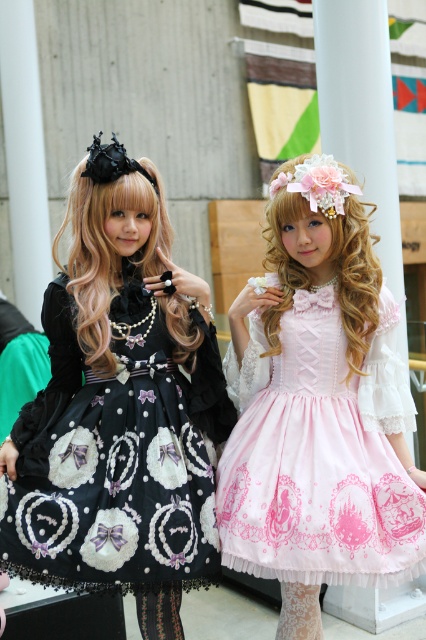
You are standing in front of the two people in the image. You want to place a small bouquet of flowers exactly at point (319, 454). Which person is the bouquet closer to?

The point (319, 454) is where the pink satin dress at center is located, so the bouquet would be closer to the person wearing the pink satin dress at center.

You are standing in front of the two individuals in the image. If you want to hand an accessory to the person wearing the black lace dress at left, which direction should you move towards based on their position?

The black lace dress at left is located at point (117,458), so you should move towards the left side of the image to reach the person wearing the black lace dress at left.

You are a photographer setting up for a photoshoot. You need to position a spotlight so that it illuminates both the black lace dress at left and the pink satin dress at center. Given their positions, which dress should you focus the spotlight on first to ensure proper lighting?

The black lace dress at left is closer to the viewer than the pink satin dress at center, so you should focus the spotlight on the black lace dress at left first to ensure proper lighting.